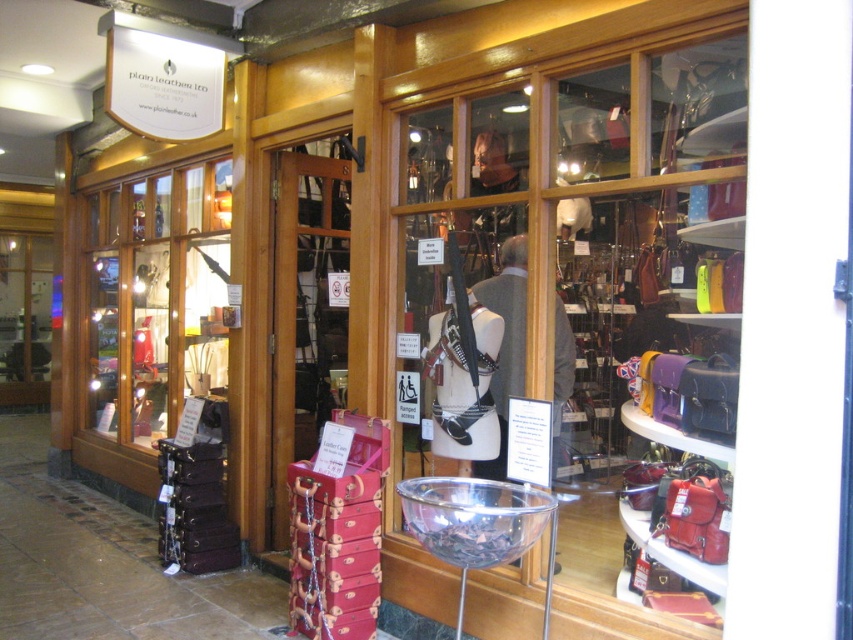
Does shiny metallic bowl at center have a lesser height compared to matte black suitcase at left?

No, shiny metallic bowl at center is not shorter than matte black suitcase at left.

Can you confirm if shiny metallic bowl at center is positioned to the left of matte black suitcase at left?

No, shiny metallic bowl at center is not to the left of matte black suitcase at left.

Is point (473, 464) closer to viewer compared to point (105, 419)?

Yes, point (473, 464) is closer to viewer.

Identify the location of shiny metallic bowl at center. This screenshot has height=640, width=853. (581, 289).